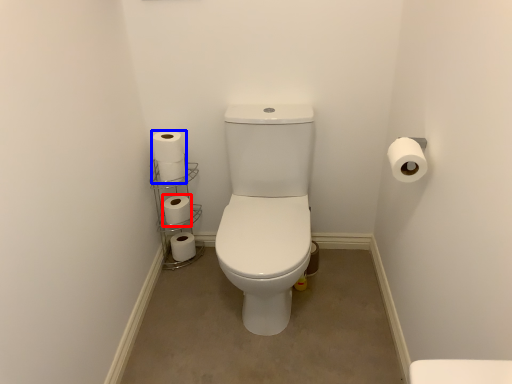
Question: Which object appears farthest to the camera in this image, toilet paper (highlighted by a red box) or toilet paper (highlighted by a blue box)?

Choices:
 (A) toilet paper
 (B) toilet paper

Answer: (A)